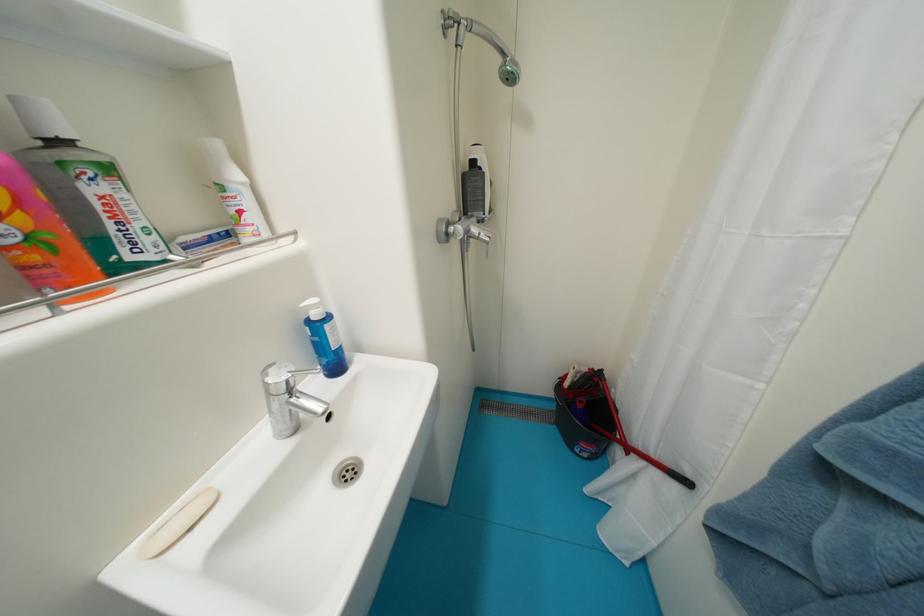
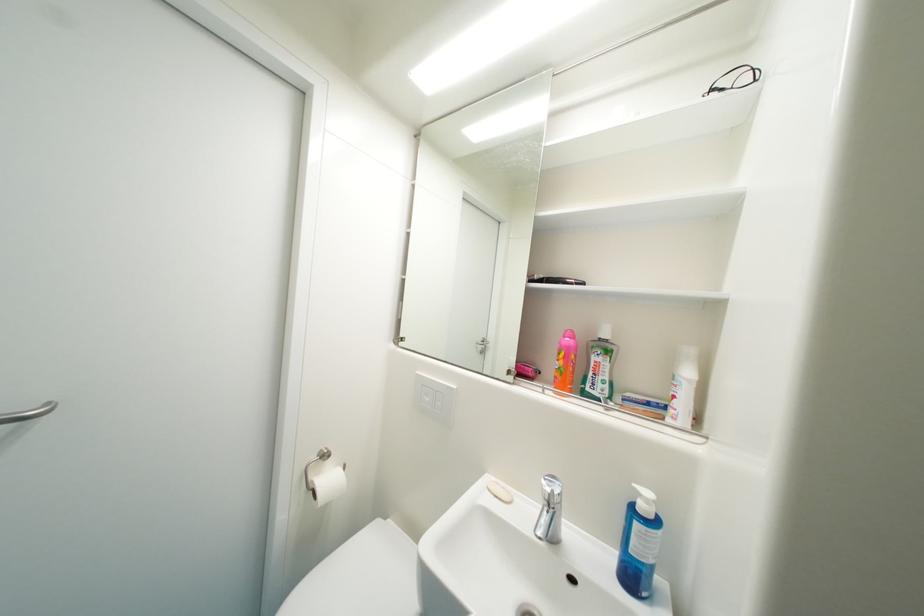
Find the pixel in the second image that matches (117,227) in the first image.

(598, 376)